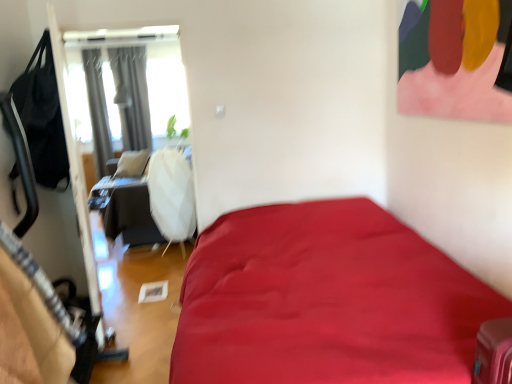
This screenshot has width=512, height=384. What do you see at coordinates (132, 96) in the screenshot? I see `gray fabric curtain at upper left, positioned as the 2th curtain in left-to-right order` at bounding box center [132, 96].

Find the location of a particular element. gray fabric curtain at upper left, the 1th curtain viewed from the right is located at coordinates (132, 96).

You are a GUI agent. You are given a task and a screenshot of the screen. Output one action in this format:
    pyautogui.click(x=<x>, y=<y>)
    Task: Click on the gray fabric curtain at upper left, the first curtain positioned from the left
    
    Given the screenshot: What is the action you would take?
    pyautogui.click(x=97, y=111)

This screenshot has height=384, width=512. What do you see at coordinates (97, 111) in the screenshot?
I see `gray fabric curtain at upper left, the first curtain positioned from the left` at bounding box center [97, 111].

What is the approximate height of gray fabric curtain at upper left, the first curtain positioned from the left?

The height of gray fabric curtain at upper left, the first curtain positioned from the left, is 7.25 feet.

At what (x,y) coordinates should I click in order to perform the action: click on gray fabric curtain at upper left, positioned as the 2th curtain in left-to-right order. Please return your answer as a coordinate pair (x, y). Looking at the image, I should click on click(x=132, y=96).

Is gray fabric curtain at upper left, marked as the 2th curtain in a right-to-left arrangement, at the left side of gray fabric curtain at upper left, positioned as the 2th curtain in left-to-right order?

Correct, you'll find gray fabric curtain at upper left, marked as the 2th curtain in a right-to-left arrangement, to the left of gray fabric curtain at upper left, positioned as the 2th curtain in left-to-right order.

Is the depth of gray fabric curtain at upper left, the first curtain positioned from the left, less than that of gray fabric curtain at upper left, positioned as the 2th curtain in left-to-right order?

Yes, it is.

Which is behind, point (90, 101) or point (144, 70)?

The point (144, 70) is more distant.

From the image's perspective, which object appears higher, gray fabric curtain at upper left, the first curtain positioned from the left, or gray fabric curtain at upper left, the 1th curtain viewed from the right?

gray fabric curtain at upper left, the 1th curtain viewed from the right, appears higher in the image.

From a real-world perspective, which is physically above, gray fabric curtain at upper left, the first curtain positioned from the left, or gray fabric curtain at upper left, the 1th curtain viewed from the right?

In real-world perspective, gray fabric curtain at upper left, the 1th curtain viewed from the right, is above.

Which object is thinner, gray fabric curtain at upper left, marked as the 2th curtain in a right-to-left arrangement, or gray fabric curtain at upper left, the 1th curtain viewed from the right?

gray fabric curtain at upper left, the 1th curtain viewed from the right.

Is gray fabric curtain at upper left, the first curtain positioned from the left, taller or shorter than gray fabric curtain at upper left, the 1th curtain viewed from the right?

Considering their sizes, gray fabric curtain at upper left, the first curtain positioned from the left, has more height than gray fabric curtain at upper left, the 1th curtain viewed from the right.

Considering the sizes of objects gray fabric curtain at upper left, the first curtain positioned from the left, and gray fabric curtain at upper left, positioned as the 2th curtain in left-to-right order, in the image provided, who is smaller, gray fabric curtain at upper left, the first curtain positioned from the left, or gray fabric curtain at upper left, positioned as the 2th curtain in left-to-right order,?

gray fabric curtain at upper left, the first curtain positioned from the left.

Is gray fabric curtain at upper left, the first curtain positioned from the left, outside of gray fabric curtain at upper left, positioned as the 2th curtain in left-to-right order?

Yes.

Can you see gray fabric curtain at upper left, the first curtain positioned from the left, touching gray fabric curtain at upper left, positioned as the 2th curtain in left-to-right order?

gray fabric curtain at upper left, the first curtain positioned from the left, and gray fabric curtain at upper left, positioned as the 2th curtain in left-to-right order, are clearly separated.

Is gray fabric curtain at upper left, the first curtain positioned from the left, oriented towards gray fabric curtain at upper left, positioned as the 2th curtain in left-to-right order?

No, gray fabric curtain at upper left, the first curtain positioned from the left, is not oriented towards gray fabric curtain at upper left, positioned as the 2th curtain in left-to-right order.

Measure the distance between gray fabric curtain at upper left, the first curtain positioned from the left, and gray fabric curtain at upper left, positioned as the 2th curtain in left-to-right order.

gray fabric curtain at upper left, the first curtain positioned from the left, and gray fabric curtain at upper left, positioned as the 2th curtain in left-to-right order, are 14.25 inches apart.

Where is `curtain below the gray fabric curtain at upper left, the 1th curtain viewed from the right (from the image's perspective)`? The image size is (512, 384). curtain below the gray fabric curtain at upper left, the 1th curtain viewed from the right (from the image's perspective) is located at coordinates (97, 111).

Visually, is gray fabric curtain at upper left, the 1th curtain viewed from the right, positioned to the left or to the right of gray fabric curtain at upper left, marked as the 2th curtain in a right-to-left arrangement?

Based on their positions, gray fabric curtain at upper left, the 1th curtain viewed from the right, is located to the right of gray fabric curtain at upper left, marked as the 2th curtain in a right-to-left arrangement.

Is gray fabric curtain at upper left, positioned as the 2th curtain in left-to-right order, positioned before gray fabric curtain at upper left, the first curtain positioned from the left?

No, it is not.

Does point (125, 115) come in front of point (97, 138)?

No.

From the image's perspective, who appears lower, gray fabric curtain at upper left, positioned as the 2th curtain in left-to-right order, or gray fabric curtain at upper left, marked as the 2th curtain in a right-to-left arrangement?

gray fabric curtain at upper left, marked as the 2th curtain in a right-to-left arrangement, from the image's perspective.

Based on the photo, from a real-world perspective, is gray fabric curtain at upper left, positioned as the 2th curtain in left-to-right order, on gray fabric curtain at upper left, marked as the 2th curtain in a right-to-left arrangement?

Yes, from a real-world perspective, gray fabric curtain at upper left, positioned as the 2th curtain in left-to-right order, is above gray fabric curtain at upper left, marked as the 2th curtain in a right-to-left arrangement.

Does gray fabric curtain at upper left, positioned as the 2th curtain in left-to-right order, have a greater width compared to gray fabric curtain at upper left, marked as the 2th curtain in a right-to-left arrangement?

No.

From their relative heights in the image, would you say gray fabric curtain at upper left, the 1th curtain viewed from the right, is taller or shorter than gray fabric curtain at upper left, marked as the 2th curtain in a right-to-left arrangement?

Considering their sizes, gray fabric curtain at upper left, the 1th curtain viewed from the right, has less height than gray fabric curtain at upper left, marked as the 2th curtain in a right-to-left arrangement.

Is gray fabric curtain at upper left, the 1th curtain viewed from the right, smaller than gray fabric curtain at upper left, the first curtain positioned from the left?

No.

Is gray fabric curtain at upper left, positioned as the 2th curtain in left-to-right order, spatially inside gray fabric curtain at upper left, the first curtain positioned from the left, or outside of it?

The correct answer is: outside.

Does gray fabric curtain at upper left, the 1th curtain viewed from the right, touch gray fabric curtain at upper left, marked as the 2th curtain in a right-to-left arrangement?

No, gray fabric curtain at upper left, the 1th curtain viewed from the right, is not touching gray fabric curtain at upper left, marked as the 2th curtain in a right-to-left arrangement.

Is gray fabric curtain at upper left, positioned as the 2th curtain in left-to-right order, turned away from gray fabric curtain at upper left, the first curtain positioned from the left?

No.

How different are the orientations of gray fabric curtain at upper left, the 1th curtain viewed from the right, and gray fabric curtain at upper left, marked as the 2th curtain in a right-to-left arrangement, in degrees?

The angle between the facing direction of gray fabric curtain at upper left, the 1th curtain viewed from the right, and the facing direction of gray fabric curtain at upper left, marked as the 2th curtain in a right-to-left arrangement, is 0.000224 degrees.

The width and height of the screenshot is (512, 384). What are the coordinates of `curtain that is in front of the gray fabric curtain at upper left, positioned as the 2th curtain in left-to-right order` in the screenshot? It's located at (97, 111).

Locate an element on the screen. The height and width of the screenshot is (384, 512). curtain behind the gray fabric curtain at upper left, the first curtain positioned from the left is located at coordinates (132, 96).

What are the coordinates of `curtain located below the gray fabric curtain at upper left, positioned as the 2th curtain in left-to-right order (from the image's perspective)` in the screenshot? It's located at (97, 111).